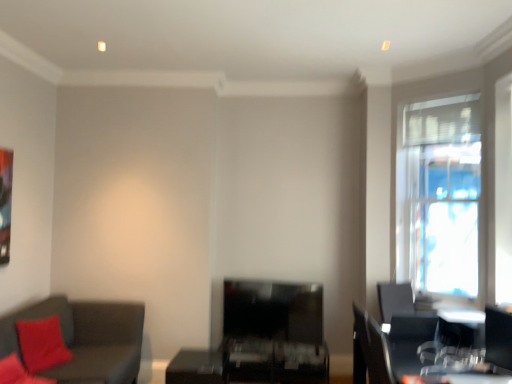
Question: Does dark gray fabric couch at lower left have a greater width compared to transparent glass window at right?

Choices:
 (A) no
 (B) yes

Answer: (B)

Question: Is dark gray fabric couch at lower left outside of transparent glass window at right?

Choices:
 (A) yes
 (B) no

Answer: (A)

Question: Can you confirm if dark gray fabric couch at lower left is thinner than transparent glass window at right?

Choices:
 (A) yes
 (B) no

Answer: (B)

Question: Can you confirm if dark gray fabric couch at lower left is bigger than transparent glass window at right?

Choices:
 (A) no
 (B) yes

Answer: (B)

Question: Can you confirm if dark gray fabric couch at lower left is smaller than transparent glass window at right?

Choices:
 (A) no
 (B) yes

Answer: (A)

Question: From their relative heights in the image, would you say transparent glass window at right is taller or shorter than matte black table at center?

Choices:
 (A) short
 (B) tall

Answer: (B)

Question: Is transparent glass window at right situated inside matte black table at center or outside?

Choices:
 (A) outside
 (B) inside

Answer: (A)

Question: Would you say transparent glass window at right is to the left or to the right of matte black table at center in the picture?

Choices:
 (A) right
 (B) left

Answer: (A)

Question: In the image, is transparent glass window at right positioned in front of or behind matte black table at center?

Choices:
 (A) behind
 (B) front

Answer: (B)

Question: Is black plastic swivel chair at lower right wider or thinner than matte black table at center?

Choices:
 (A) thin
 (B) wide

Answer: (A)

Question: From a real-world perspective, is black plastic swivel chair at lower right physically located above or below matte black table at center?

Choices:
 (A) above
 (B) below

Answer: (A)

Question: Is point (509, 314) positioned closer to the camera than point (309, 362)?

Choices:
 (A) farther
 (B) closer

Answer: (B)

Question: Is black plastic swivel chair at lower right bigger or smaller than matte black table at center?

Choices:
 (A) big
 (B) small

Answer: (B)

Question: In the image, is dark gray fabric couch at lower left positioned in front of or behind black plastic swivel chair at lower right?

Choices:
 (A) behind
 (B) front

Answer: (B)

Question: Is dark gray fabric couch at lower left wider or thinner than black plastic swivel chair at lower right?

Choices:
 (A) thin
 (B) wide

Answer: (B)